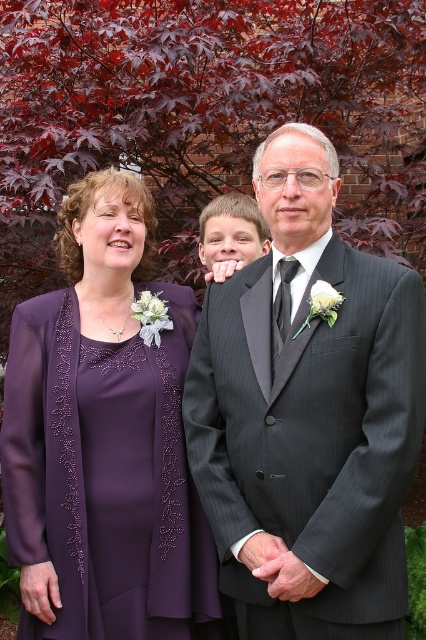
You are a photographer setting up for a group photo. You need to ensure there is enough space between the purple satin dress at left and the matte gray suit at center for a tripod. The tripod requires at least 30 inches of space. Is there enough space?

The purple satin dress at left and the matte gray suit at center are 33.32 inches apart, which is more than the required 30 inches, so there is enough space for the tripod.

Based on the scene description, which object is narrower between the dark gray pinstripe suit at center and the purple satin dress at left?

The dark gray pinstripe suit at center is narrower than the purple satin dress at left.